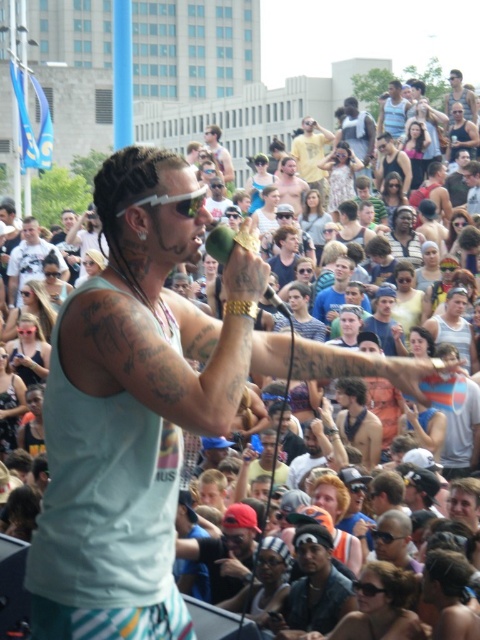
Is matte black tank top at center wider than matte black phone at center?

Yes.

Can you confirm if matte black tank top at center is shorter than matte black phone at center?

No, matte black tank top at center is not shorter than matte black phone at center.

Between point (9, 296) and point (12, 369), which one is positioned in front?

Point (12, 369) is in front.

I want to click on matte black tank top at center, so click(x=29, y=260).

Can you confirm if matte black tank top at center is positioned above yellow cotton shirt at upper center?

No, matte black tank top at center is not above yellow cotton shirt at upper center.

Who is taller, matte black tank top at center or yellow cotton shirt at upper center?

yellow cotton shirt at upper center is taller.

The width and height of the screenshot is (480, 640). Identify the location of matte black tank top at center. (29, 260).

Measure the distance between point (334, 576) and camera.

The distance of point (334, 576) from camera is 35.03 meters.

Which is in front, point (348, 584) or point (268, 291)?

Point (268, 291)

The height and width of the screenshot is (640, 480). Identify the location of black leather cap at center. (313, 588).